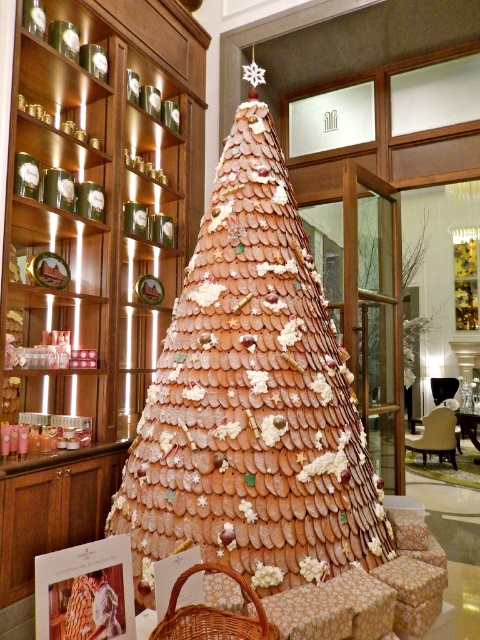
Question: Which point is closer to the camera taking this photo?

Choices:
 (A) (278, 550)
 (B) (251, 636)

Answer: (B)

Question: Observing the image, what is the correct spatial positioning of cinnamon-brown gingerbread cone at center in reference to woven brown basket at lower center?

Choices:
 (A) above
 (B) below

Answer: (A)

Question: Which point is farther to the camera?

Choices:
 (A) cinnamon-brown gingerbread cone at center
 (B) woven brown basket at lower center

Answer: (A)

Question: Is cinnamon-brown gingerbread cone at center smaller than woven brown basket at lower center?

Choices:
 (A) yes
 (B) no

Answer: (B)

Question: Among these points, which one is nearest to the camera?

Choices:
 (A) (171, 592)
 (B) (368, 490)

Answer: (A)

Question: Is cinnamon-brown gingerbread cone at center in front of woven brown basket at lower center?

Choices:
 (A) no
 (B) yes

Answer: (A)